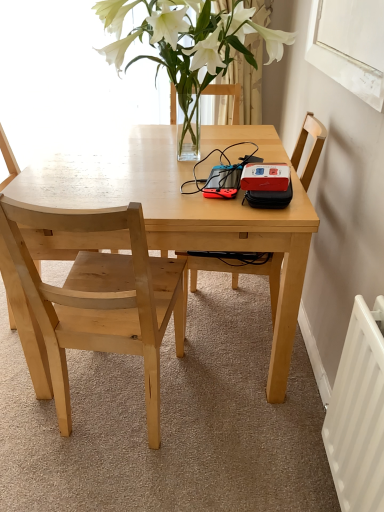
You are a GUI agent. You are given a task and a screenshot of the screen. Output one action in this format:
    pyautogui.click(x=<x>, y=<y>)
    Task: Click on the vacant area that is situated to the right of light wood chair at left, positioned as the 2th chair in left-to-right order
    The image size is (384, 512).
    Given the screenshot: What is the action you would take?
    pyautogui.click(x=242, y=437)